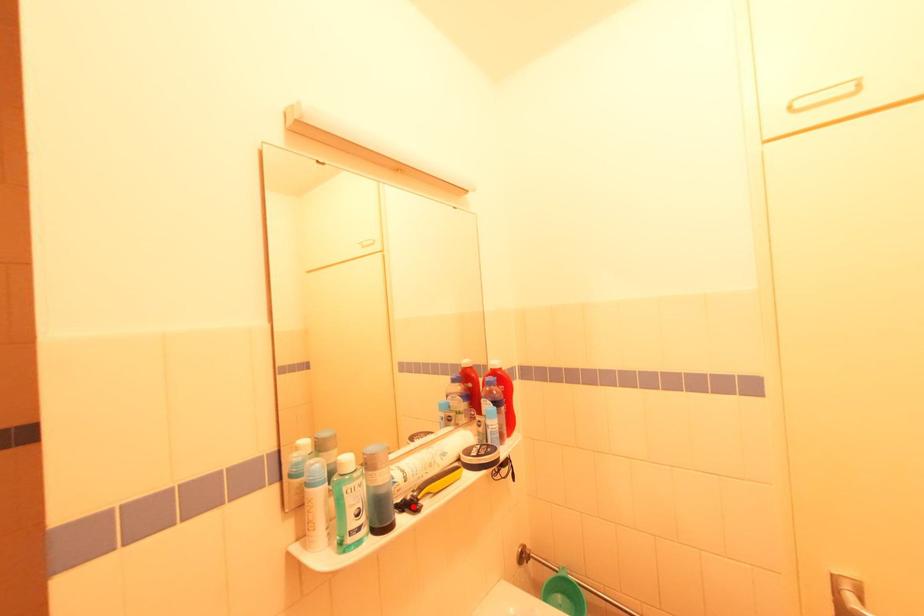
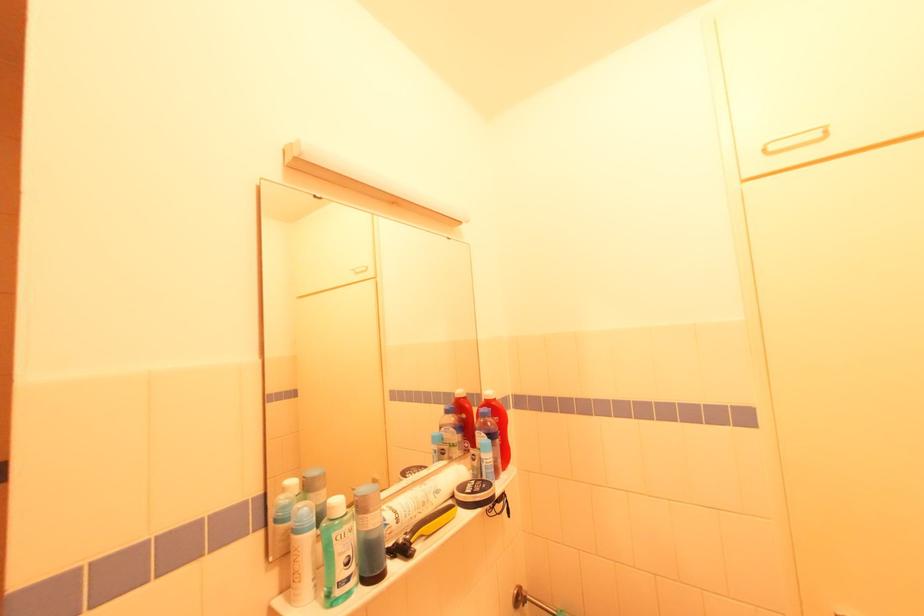
In the second image, find the point that corresponds to the highlighted location in the first image.

(406, 552)